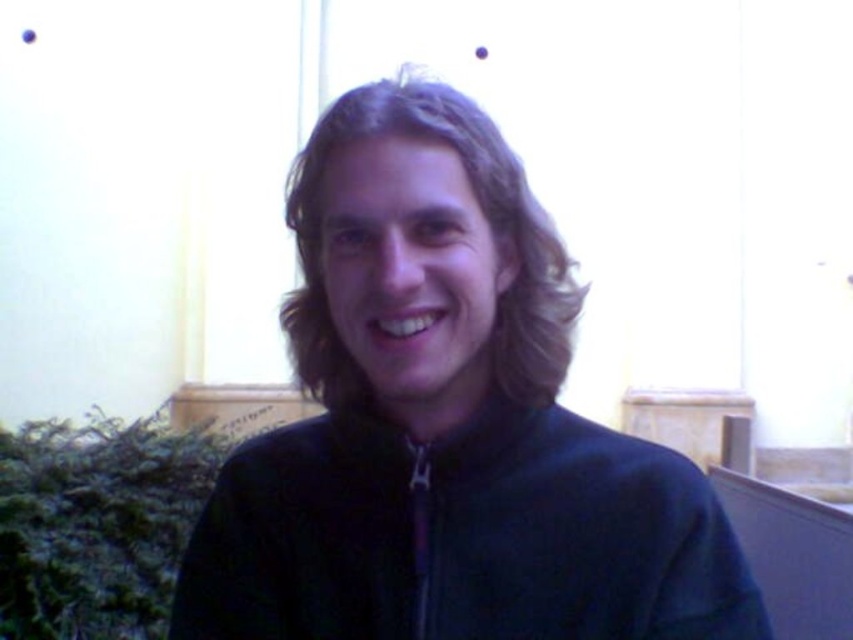
You are a photographer trying to capture a closeup of the dark blue fleece jacket at center and dark brown wavy hair at center. Which object is wider in the frame?

The dark blue fleece jacket at center is wider than the dark brown wavy hair at center.